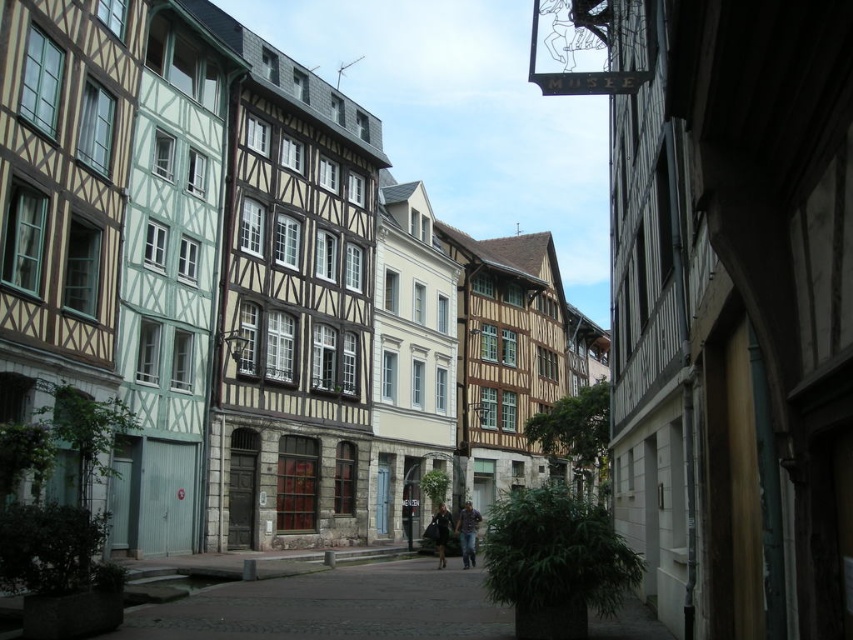
You are a street vendor setting up a stall in the historic town. You have two items to display on your cart, the denim jeans at center and the dark blue fabric coat at center. Since space is limited, you need to know which item takes up more space. Which one is larger?

The denim jeans at center is bigger than the dark blue fabric coat at center, so the denim jeans at center takes up more space.

You are a tourist standing on the cobblestone street in the historic town. You see the denim jeans at center and the dark blue fabric coat at center. Which one is positioned to the right side?

The denim jeans at center is positioned to the right of the dark blue fabric coat at center.